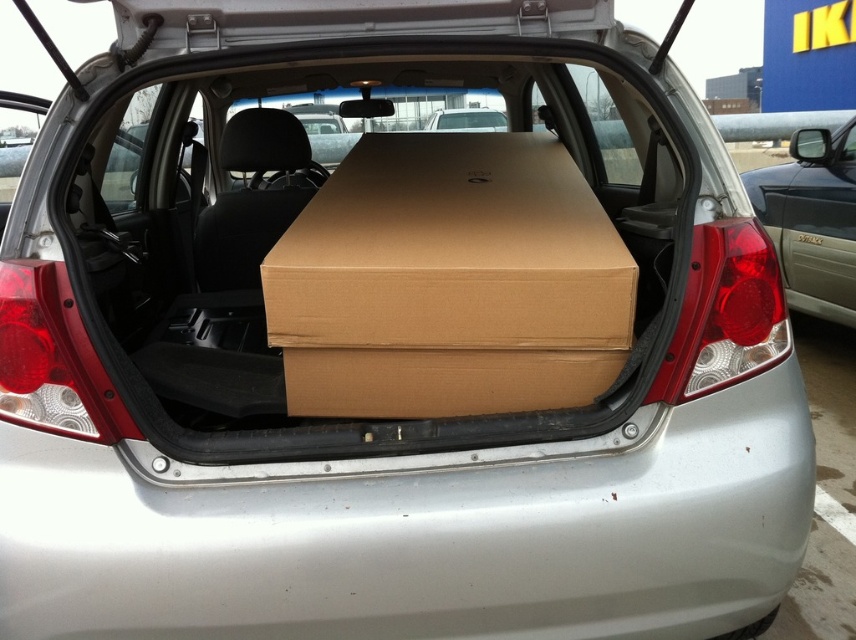
Question: Can you confirm if brown cardboard box at center is wider than matte brown minivan at right?

Choices:
 (A) no
 (B) yes

Answer: (B)

Question: Does brown cardboard box at center appear on the left side of matte brown minivan at right?

Choices:
 (A) no
 (B) yes

Answer: (B)

Question: Is brown cardboard box at center in front of matte brown minivan at right?

Choices:
 (A) no
 (B) yes

Answer: (B)

Question: Which object is farther from the camera taking this photo?

Choices:
 (A) matte brown minivan at right
 (B) brown cardboard box at center

Answer: (A)